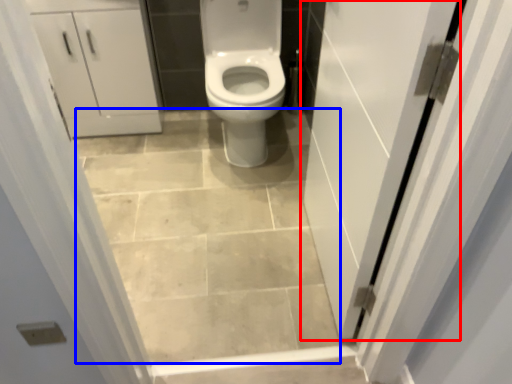
Question: Which object is further to the camera taking this photo, door (highlighted by a red box) or ceramic tile (highlighted by a blue box)?

Choices:
 (A) door
 (B) ceramic tile

Answer: (B)